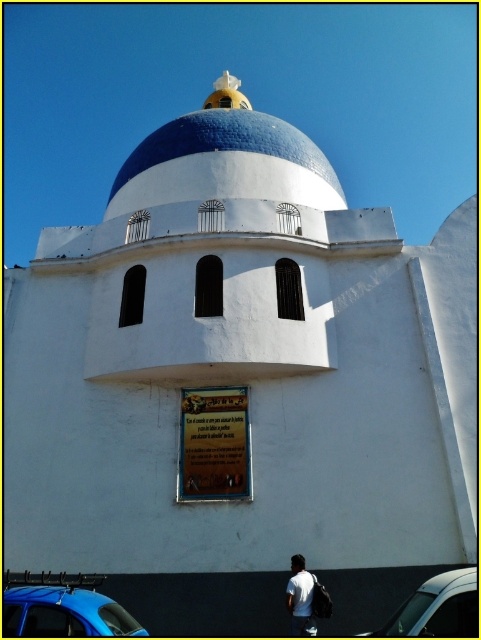
You are standing in front of the building and want to touch both point (50, 618) and point (291, 577). Which point should you reach for first?

You should reach for point (50, 618) first because it is closer to you than point (291, 577).

You are standing in front of the building and want to take a photo of both the blue tiled dome at upper center and the white matte shirt at lower center in the same frame. Based on their distance, will you need to zoom in or zoom out to include both in the shot?

The blue tiled dome at upper center and white matte shirt at lower center are 17.40 meters apart from each other. To include both in the same frame, you would need to zoom out to capture the entire distance between them.

You are standing in front of the building and notice two cars, a metallic blue car at lower left and a metallic silver car at lower right. Which car is positioned closer to the base of the building?

The metallic blue car at lower left is closer to the base of the building because it is located below the metallic silver car at lower right.